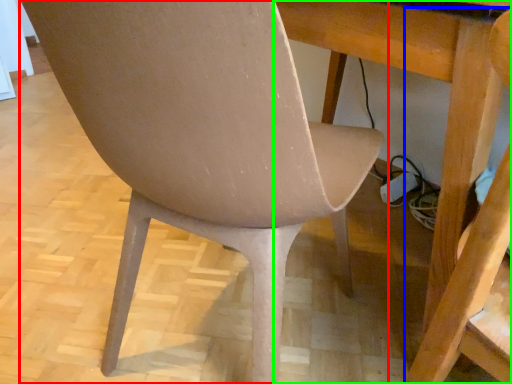
Question: Estimate the real-world distances between objects in this image. Which object is farther from chair (highlighted by a red box), swivel chair (highlighted by a blue box) or table (highlighted by a green box)?

Choices:
 (A) swivel chair
 (B) table

Answer: (A)